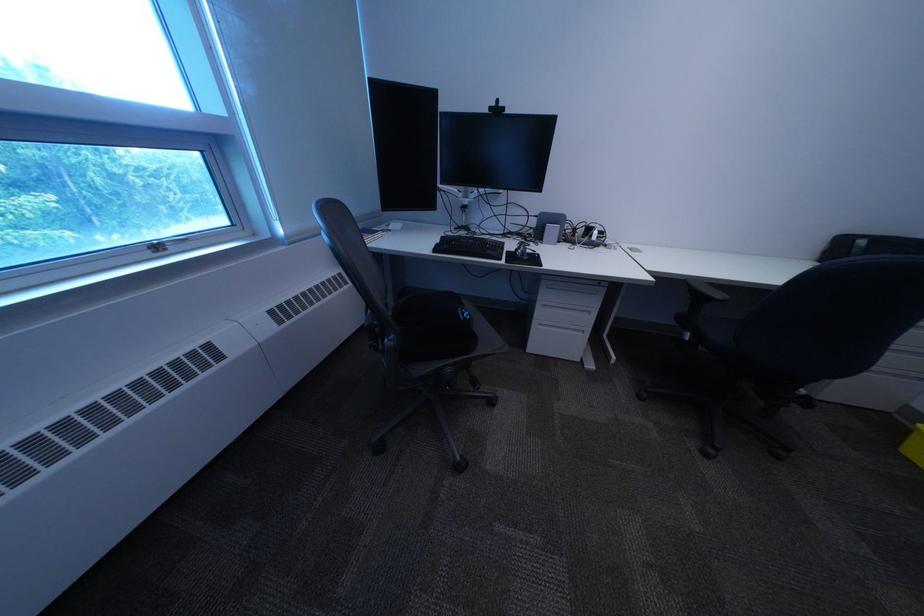
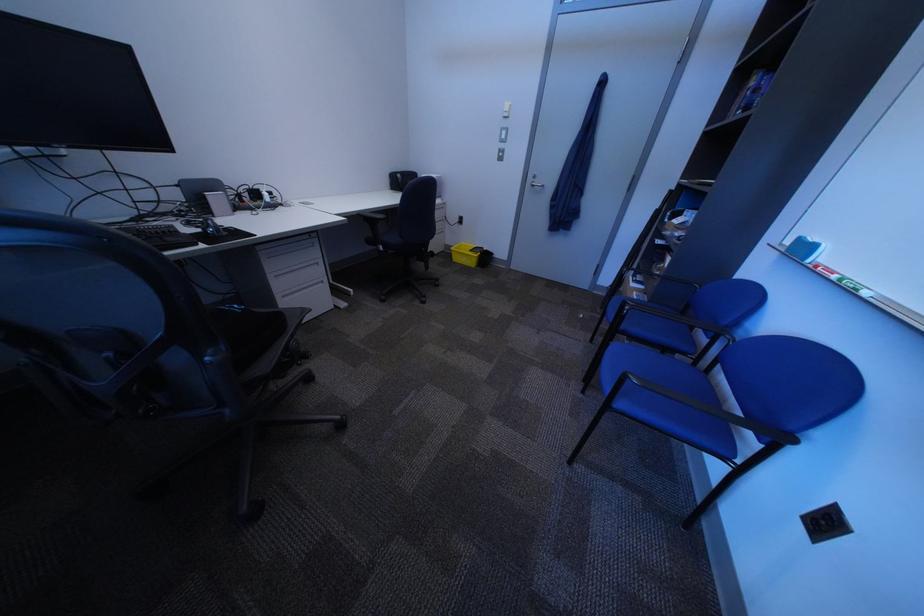
First-person continuous shooting, in which direction is the camera rotating?

The camera's rotation is toward right-down.